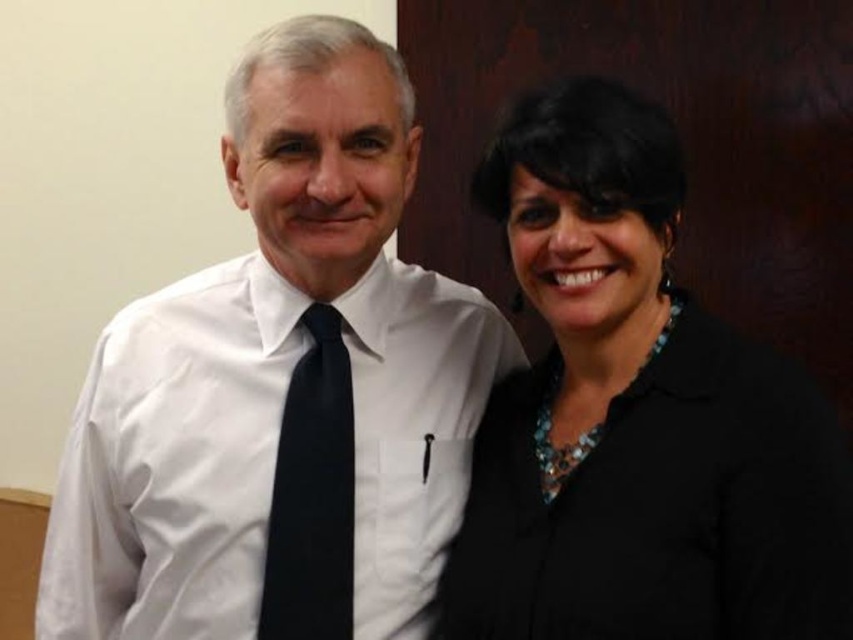
Does white satin shirt at left have a lesser width compared to black satin tie at center?

Incorrect, white satin shirt at left's width is not less than black satin tie at center's.

Looking at this image, can you confirm if white satin shirt at left is wider than black satin tie at center?

Indeed, white satin shirt at left has a greater width compared to black satin tie at center.

Between point (323, 22) and point (338, 428), which one is positioned in front?

Point (323, 22)

At what (x,y) coordinates should I click in order to perform the action: click on white satin shirt at left. Please return your answer as a coordinate pair (x, y). Looking at the image, I should click on (281, 387).

Does white satin shirt at left have a lesser width compared to black matte blazer at right?

No, white satin shirt at left is not thinner than black matte blazer at right.

Between point (291, 136) and point (489, 509), which one is positioned behind?

Positioned behind is point (489, 509).

Between point (367, 497) and point (755, 344), which one is positioned behind?

Positioned behind is point (367, 497).

Find the location of a particular element. The width and height of the screenshot is (853, 640). white satin shirt at left is located at coordinates (281, 387).

The width and height of the screenshot is (853, 640). What do you see at coordinates (636, 417) in the screenshot?
I see `black matte blazer at right` at bounding box center [636, 417].

Which of these two, black matte blazer at right or black satin tie at center, stands shorter?

black satin tie at center is shorter.

Measure the distance between black matte blazer at right and camera.

They are 34.35 inches apart.

Locate an element on the screen. This screenshot has height=640, width=853. black matte blazer at right is located at coordinates pos(636,417).